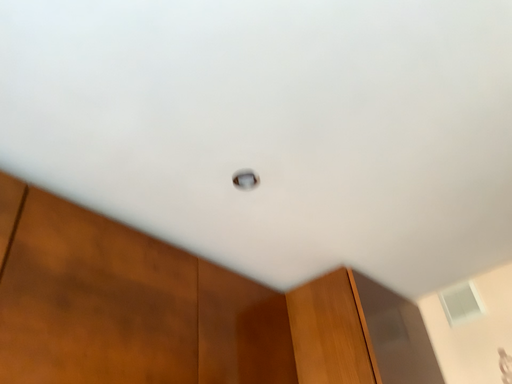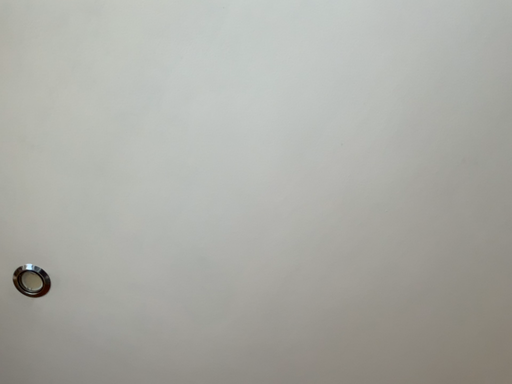
Question: How did the camera likely rotate when shooting the video?

Choices:
 (A) rotated right
 (B) rotated left

Answer: (B)